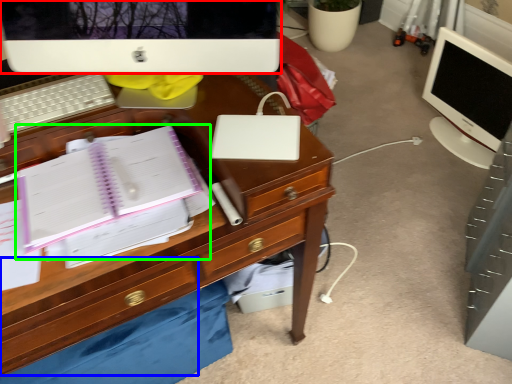
Question: Estimate the real-world distances between objects in this image. Which object is farther from computer monitor (highlighted by a red box), drawer (highlighted by a blue box) or notebook (highlighted by a green box)?

Choices:
 (A) drawer
 (B) notebook

Answer: (A)